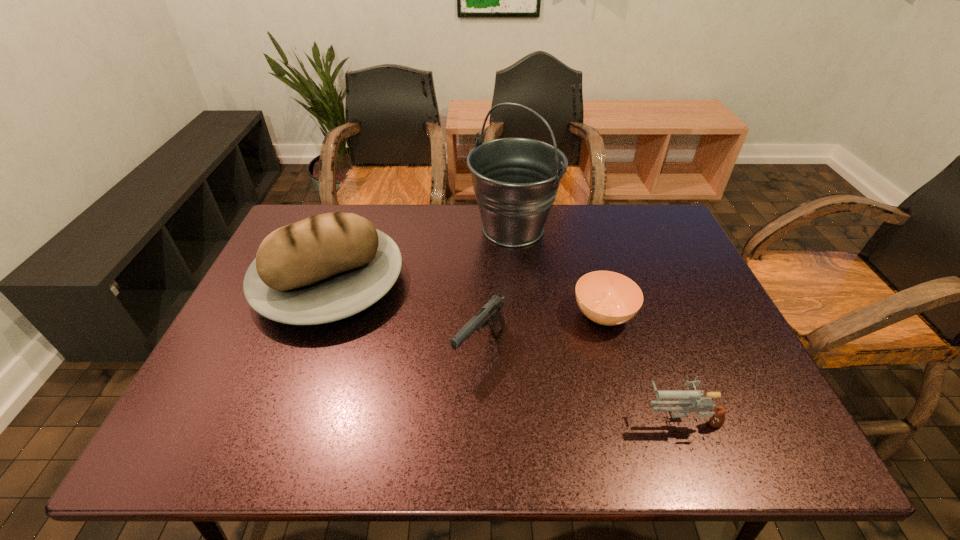
Image resolution: width=960 pixels, height=540 pixels. I want to click on free space that satisfies the following two spatial constraints: 1. on the front side of the shortest object; 2. on the left side of the fourth shortest object, so click(317, 315).